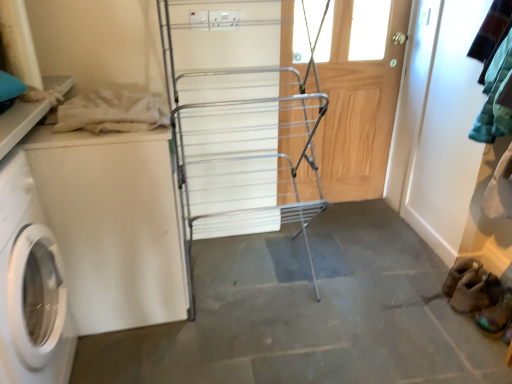
Where is `free space that is in between silver metallic drying rack at center and brown suede shoe at lower right, arranged as the first shoe when viewed from the back`? free space that is in between silver metallic drying rack at center and brown suede shoe at lower right, arranged as the first shoe when viewed from the back is located at coordinates (359, 294).